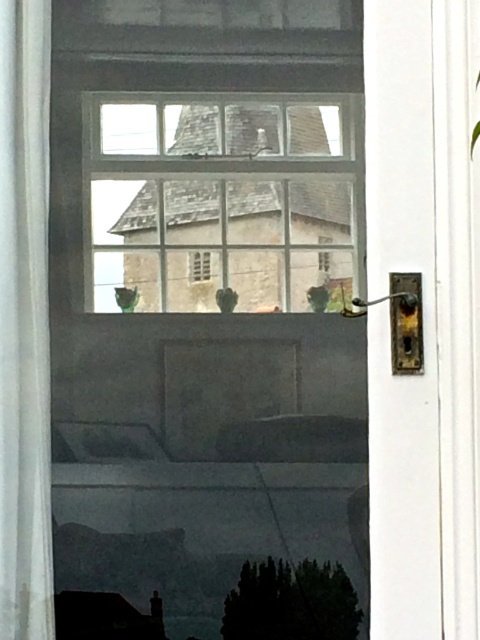
From the picture: Is white glossy screen door at right positioned at the back of green leafy plant at lower center?

No, it is not.

Does white glossy screen door at right appear on the right side of green leafy plant at lower center?

Indeed, white glossy screen door at right is positioned on the right side of green leafy plant at lower center.

Who is more distant from viewer, (x=441, y=232) or (x=313, y=593)?

Positioned behind is point (x=313, y=593).

At what (x,y) coordinates should I click in order to perform the action: click on white glossy screen door at right. Please return your answer as a coordinate pair (x, y). Looking at the image, I should click on (423, 316).

Is clear glass window at upper center below green leafy plant at lower center?

Incorrect, clear glass window at upper center is not positioned below green leafy plant at lower center.

Is point (272, 292) farther from viewer compared to point (288, 628)?

Yes, it is behind point (288, 628).

Which is in front, point (180, 240) or point (244, 576)?

Point (244, 576)

What are the coordinates of `clear glass window at upper center` in the screenshot? It's located at (231, 198).

Can you confirm if white glossy screen door at right is bigger than white fabric curtain at left?

Correct, white glossy screen door at right is larger in size than white fabric curtain at left.

Does white glossy screen door at right appear on the right side of white fabric curtain at left?

Indeed, white glossy screen door at right is positioned on the right side of white fabric curtain at left.

Who is more forward, (457, 592) or (47, 129)?

Positioned in front is point (457, 592).

Find the location of a particular element. The height and width of the screenshot is (640, 480). white glossy screen door at right is located at coordinates (423, 316).